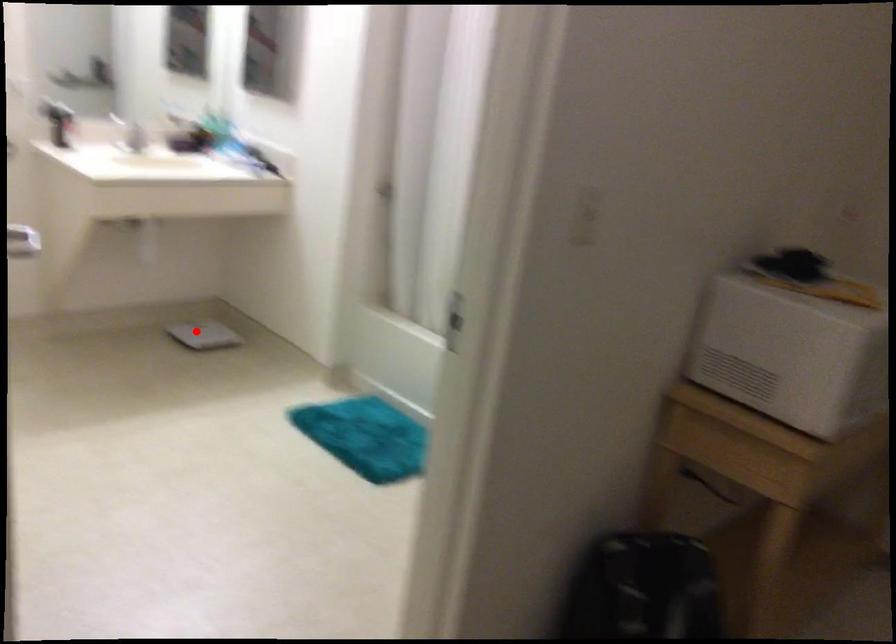
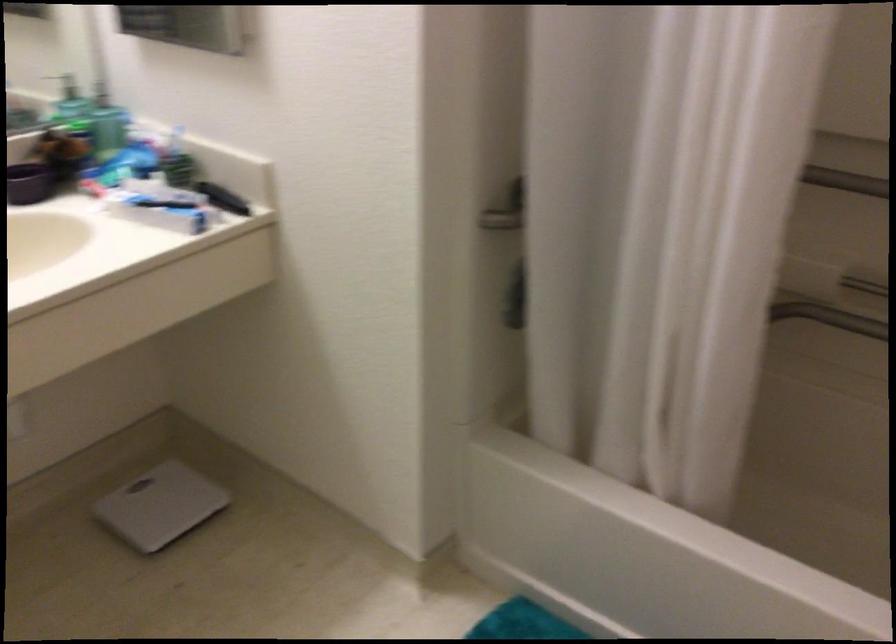
The point at the highlighted location is marked in the first image. Where is the corresponding point in the second image?

(159, 506)